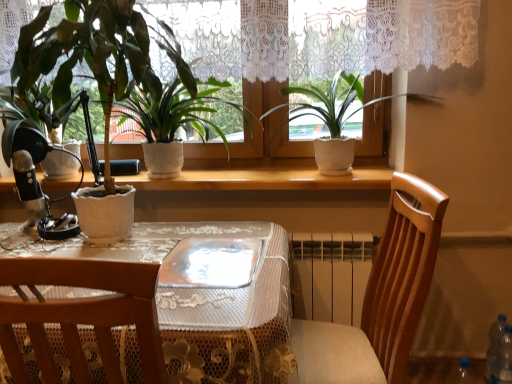
Where is `vacant space in front of transparent glass plate at center`? The width and height of the screenshot is (512, 384). vacant space in front of transparent glass plate at center is located at coordinates [x=212, y=309].